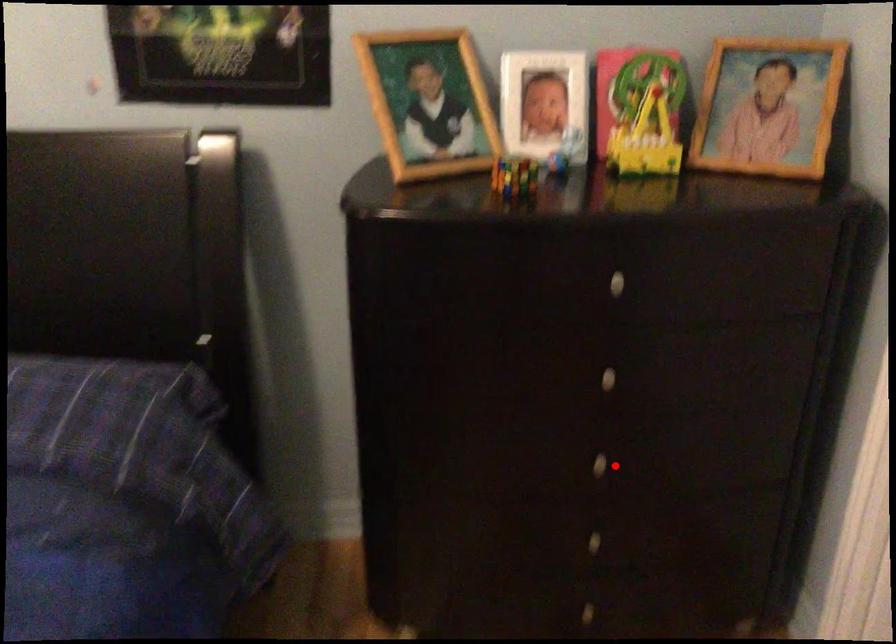
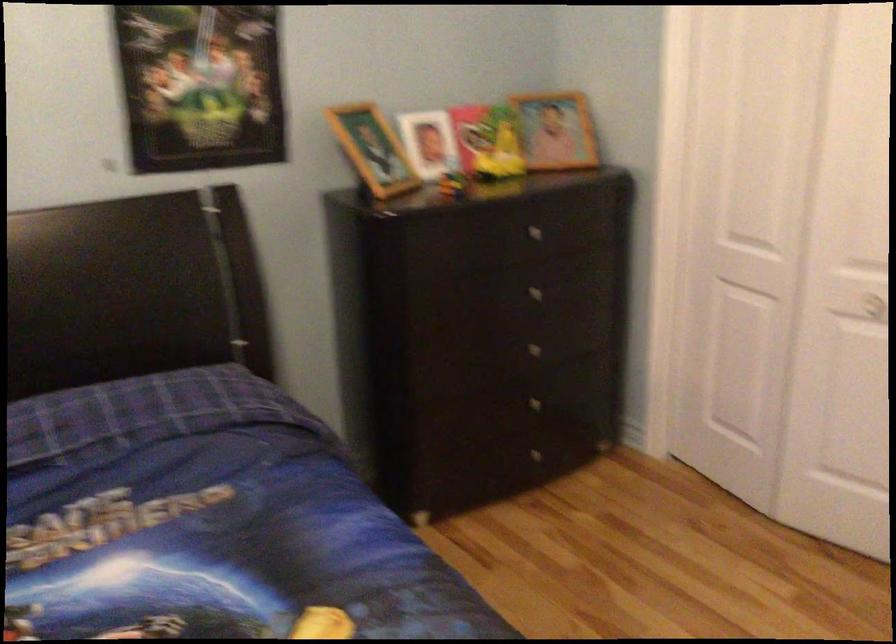
Where in the second image is the point corresponding to the highlighted location from the first image?

(539, 353)